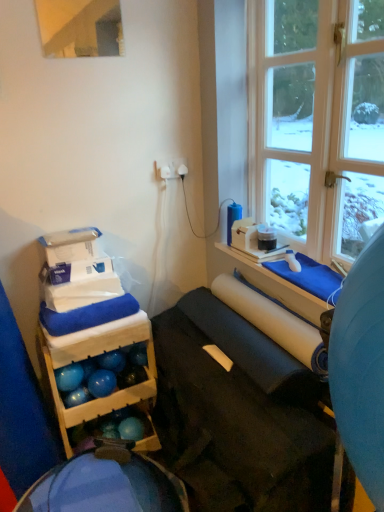
Image resolution: width=384 pixels, height=512 pixels. Describe the element at coordinates (316, 118) in the screenshot. I see `clear glass window at upper right` at that location.

Measure the distance between point (55, 337) and camera.

1.58 meters.

The image size is (384, 512). Find the location of `matte black yoga mat at center`. matte black yoga mat at center is located at coordinates (239, 413).

Where is `clear glass window at upper right`? This screenshot has width=384, height=512. clear glass window at upper right is located at coordinates (316, 118).

How many degrees apart are the facing directions of clear glass window at upper right and wooden storage at left?

They differ by 91.2 degrees in their facing directions.

From the image's perspective, which is below, clear glass window at upper right or wooden storage at left?

From the image's view, wooden storage at left is below.

Is clear glass window at upper right closer to the viewer compared to wooden storage at left?

Yes, clear glass window at upper right is closer to the camera.

Is clear glass window at upper right oriented towards wooden storage at left?

No, clear glass window at upper right is not facing towards wooden storage at left.

Based on the photo, considering the sizes of white matte paper towel at center and blue fabric bean bag at lower left in the image, is white matte paper towel at center bigger or smaller than blue fabric bean bag at lower left?

white matte paper towel at center is smaller than blue fabric bean bag at lower left.

Which object is further away from the camera, white matte paper towel at center or blue fabric bean bag at lower left?

white matte paper towel at center is further away from the camera.

Would you say white matte paper towel at center is inside or outside blue fabric bean bag at lower left?

white matte paper towel at center is not inside blue fabric bean bag at lower left, it's outside.

Does matte black yoga mat at center have a smaller size compared to white matte paper towel at center?

Actually, matte black yoga mat at center might be larger than white matte paper towel at center.

Which of these two, matte black yoga mat at center or white matte paper towel at center, stands taller?

matte black yoga mat at center is taller.

Could you tell me if matte black yoga mat at center is facing white matte paper towel at center?

No.

Measure the distance from matte black yoga mat at center to white matte paper towel at center.

A distance of 22.25 centimeters exists between matte black yoga mat at center and white matte paper towel at center.

Does blue fabric bean bag at lower left appear on the right side of wooden storage at left?

Yes, blue fabric bean bag at lower left is to the right of wooden storage at left.

Are blue fabric bean bag at lower left and wooden storage at left making contact?

They are not placed beside each other.

Is blue fabric bean bag at lower left taller or shorter than wooden storage at left?

blue fabric bean bag at lower left is shorter than wooden storage at left.

Which point is more distant from viewer, (x=159, y=475) or (x=113, y=335)?

The point (x=113, y=335) is farther from the camera.

From a real-world perspective, is wooden storage at left physically located above or below clear glass window at upper right?

Clearly, from a real-world perspective, wooden storage at left is below clear glass window at upper right.

Would you say wooden storage at left is outside clear glass window at upper right?

Indeed, wooden storage at left is completely outside clear glass window at upper right.

How distant is wooden storage at left from clear glass window at upper right?

A distance of 38.47 inches exists between wooden storage at left and clear glass window at upper right.

Does wooden storage at left have a smaller size compared to clear glass window at upper right?

Actually, wooden storage at left might be larger than clear glass window at upper right.

Which of these two, wooden storage at left or white matte paper towel at center, is wider?

Wider between the two is wooden storage at left.

Is wooden storage at left next to white matte paper towel at center and touching it?

No, wooden storage at left is not beside white matte paper towel at center.

How different are the orientations of wooden storage at left and white matte paper towel at center in degrees?

91.2 degrees.

Is blue fabric bean bag at lower left oriented towards white matte paper towel at center?

No.

Which object is further away from the camera taking this photo, blue fabric bean bag at lower left or white matte paper towel at center?

white matte paper towel at center is behind.

From the image's perspective, is blue fabric bean bag at lower left beneath white matte paper towel at center?

Indeed, from the image's perspective, blue fabric bean bag at lower left is shown beneath white matte paper towel at center.

Can white matte paper towel at center be found inside blue fabric bean bag at lower left?

No, white matte paper towel at center is not a part of blue fabric bean bag at lower left.

At what (x,y) coordinates should I click in order to perform the action: click on window in front of the wooden storage at left. Please return your answer as a coordinate pair (x, y). Image resolution: width=384 pixels, height=512 pixels. Looking at the image, I should click on (316, 118).

Where is `paper towel behind the blue fabric bean bag at lower left`? This screenshot has width=384, height=512. paper towel behind the blue fabric bean bag at lower left is located at coordinates (274, 322).

Looking at this image, which object lies further to the anchor point matte black yoga mat at center, clear glass window at upper right or blue fabric bean bag at lower left?

clear glass window at upper right is positioned further to the anchor matte black yoga mat at center.

Estimate the real-world distances between objects in this image. Which object is further from clear glass window at upper right, white matte paper towel at center or matte black yoga mat at center?

matte black yoga mat at center is positioned further to the anchor clear glass window at upper right.

From the image, which object appears to be farther from white matte paper towel at center, wooden storage at left or blue fabric bean bag at lower left?

Among the two, blue fabric bean bag at lower left is located further to white matte paper towel at center.

From the image, which object appears to be nearer to wooden storage at left, blue fabric bean bag at lower left or matte black yoga mat at center?

blue fabric bean bag at lower left lies closer to wooden storage at left than the other object.

When comparing their distances from clear glass window at upper right, does matte black yoga mat at center or wooden storage at left seem closer?

matte black yoga mat at center is closer to clear glass window at upper right.

From the image, which object appears to be nearer to matte black yoga mat at center, wooden storage at left or white matte paper towel at center?

The object closer to matte black yoga mat at center is white matte paper towel at center.

From the image, which object appears to be farther from clear glass window at upper right, blue fabric bean bag at lower left or white matte paper towel at center?

The object further to clear glass window at upper right is blue fabric bean bag at lower left.

Estimate the real-world distances between objects in this image. Which object is closer to blue fabric bean bag at lower left, clear glass window at upper right or white matte paper towel at center?

white matte paper towel at center.

This screenshot has width=384, height=512. I want to click on furniture between clear glass window at upper right and blue fabric bean bag at lower left from top to bottom, so click(239, 413).

Find the location of a particular element. This screenshot has width=384, height=512. shelf between clear glass window at upper right and matte black yoga mat at center vertically is located at coordinates (94, 356).

Locate an element on the screen. The width and height of the screenshot is (384, 512). bean bag chair located between matte black yoga mat at center and wooden storage at left in the depth direction is located at coordinates (106, 485).

The image size is (384, 512). I want to click on paper towel that lies between clear glass window at upper right and wooden storage at left from top to bottom, so click(274, 322).